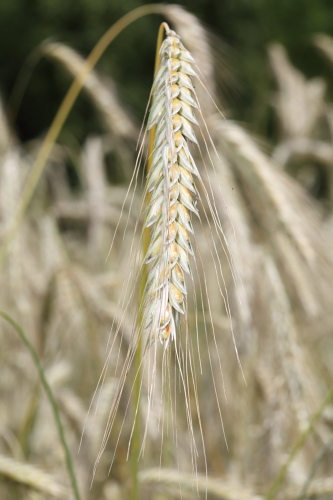
The image size is (333, 500). Identify the location of plant. (176, 137).